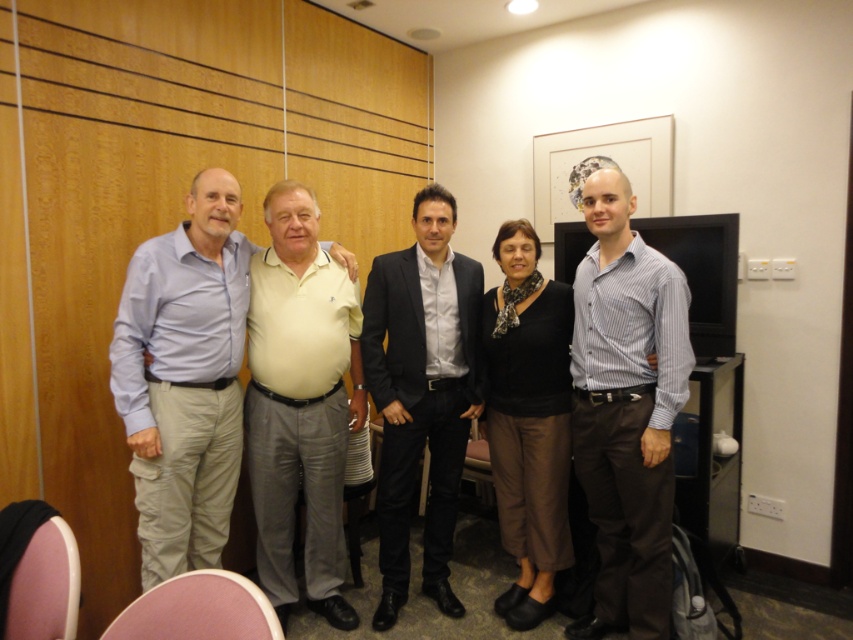
In the scene shown: You are standing in the conference room and want to take a photo of both point markers. Which point marker, point (334, 464) or point (387, 477), will appear larger in the photo?

Point (334, 464) is closer to the camera than point (387, 477), so it will appear larger in the photo.